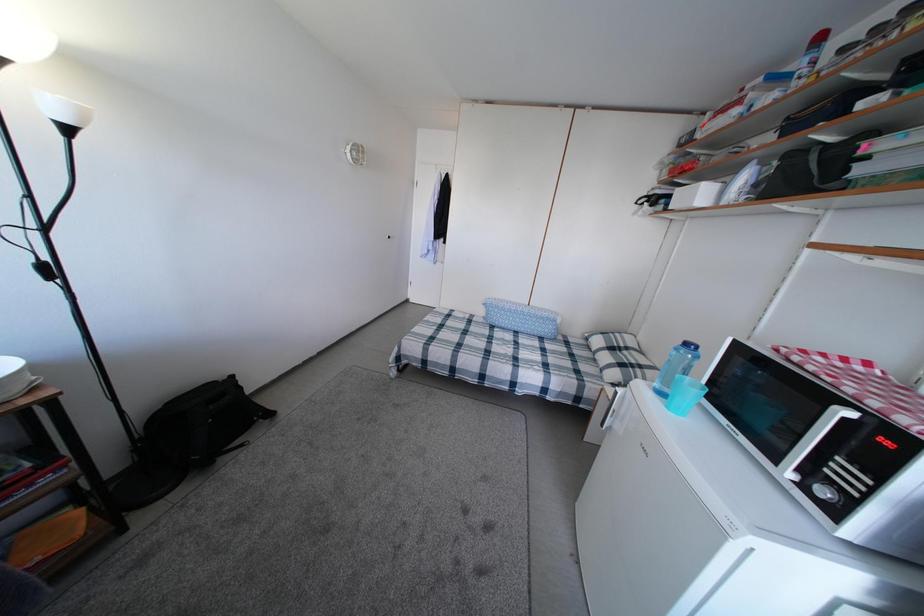
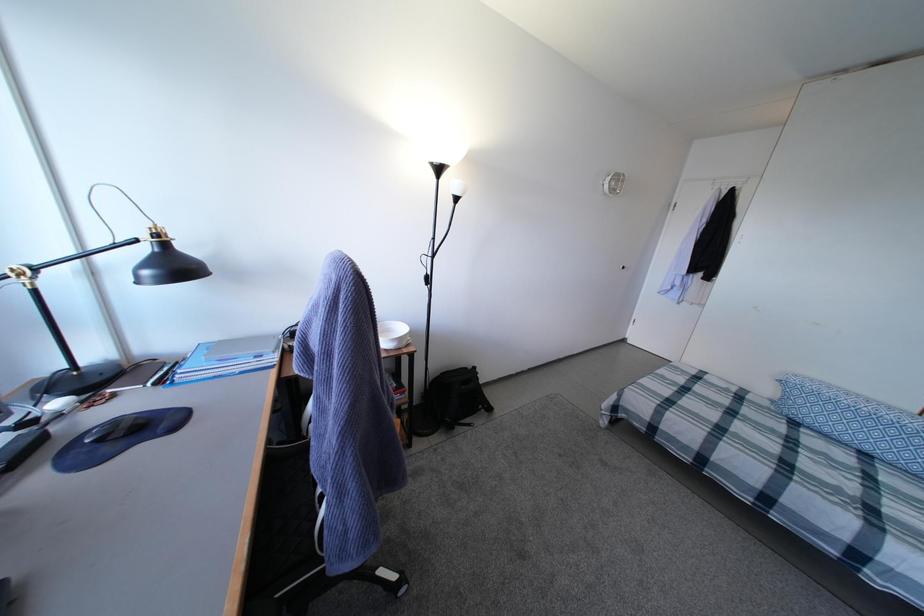
Question: How did the camera likely rotate?

Choices:
 (A) Left
 (B) Right
 (C) Up
 (D) Down

Answer: (A)